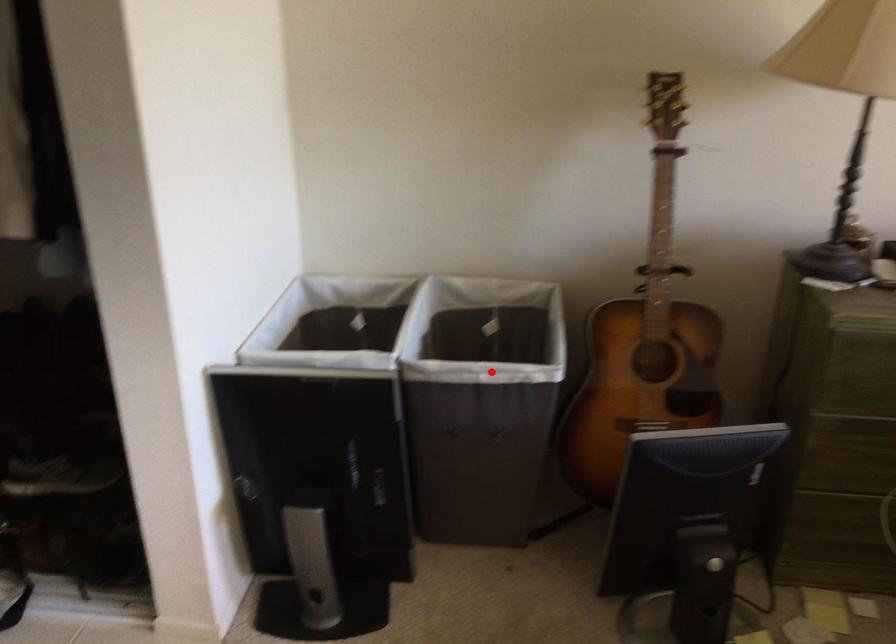
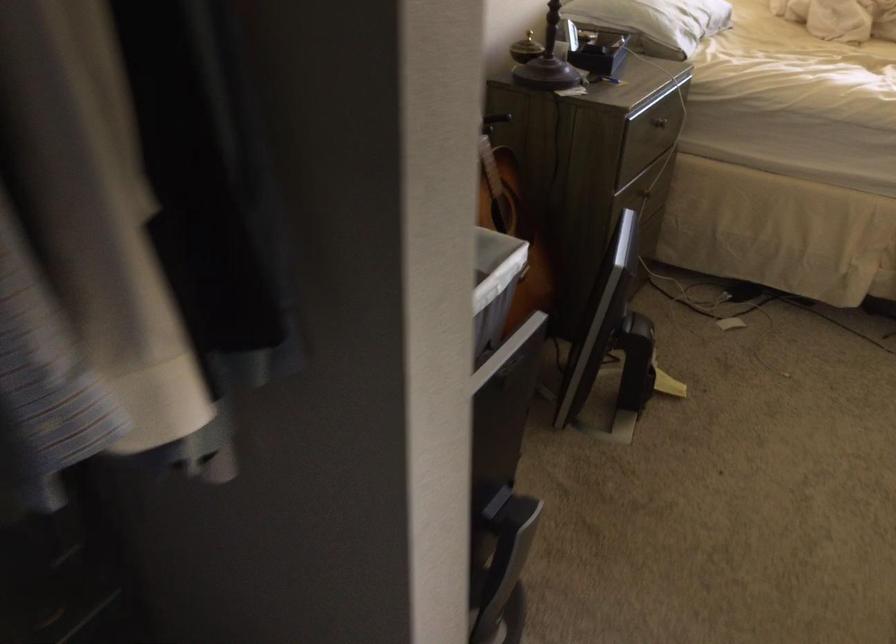
Question: I am providing you with two images of the same scene from different viewpoints. In image1, a red point is highlighted. Considering the same 3D point in image2, which of the following is correct?

Choices:
 (A) It is closer
 (B) It is farther

Answer: (A)